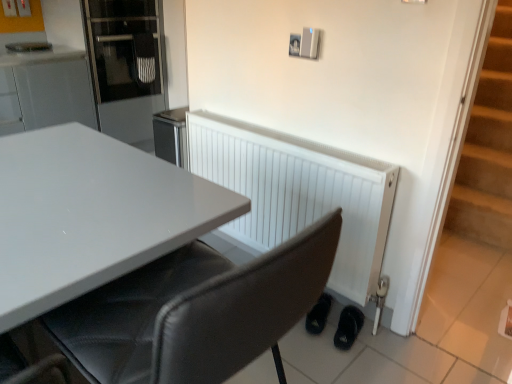
Question: Considering the relative sizes of white matte radiator at lower right and black leather chair at center in the image provided, is white matte radiator at lower right smaller than black leather chair at center?

Choices:
 (A) no
 (B) yes

Answer: (B)

Question: Is white matte radiator at lower right positioned beyond the bounds of black leather chair at center?

Choices:
 (A) yes
 (B) no

Answer: (A)

Question: Is white matte radiator at lower right touching black leather chair at center?

Choices:
 (A) yes
 (B) no

Answer: (B)

Question: From a real-world perspective, is white matte radiator at lower right positioned over black leather chair at center based on gravity?

Choices:
 (A) no
 (B) yes

Answer: (A)

Question: From the image's perspective, does white matte radiator at lower right appear higher than black leather chair at center?

Choices:
 (A) yes
 (B) no

Answer: (A)

Question: Considering the relative sizes of white matte radiator at lower right and black leather chair at center in the image provided, is white matte radiator at lower right wider than black leather chair at center?

Choices:
 (A) yes
 (B) no

Answer: (B)

Question: Is glass door refrigerator at upper left far away from black leather chair at center?

Choices:
 (A) no
 (B) yes

Answer: (B)

Question: Considering the relative sizes of glass door refrigerator at upper left and black leather chair at center in the image provided, is glass door refrigerator at upper left wider than black leather chair at center?

Choices:
 (A) no
 (B) yes

Answer: (B)

Question: Is glass door refrigerator at upper left positioned with its back to black leather chair at center?

Choices:
 (A) yes
 (B) no

Answer: (B)

Question: From the image's perspective, does glass door refrigerator at upper left appear higher than black leather chair at center?

Choices:
 (A) yes
 (B) no

Answer: (A)

Question: From a real-world perspective, is glass door refrigerator at upper left located higher than black leather chair at center?

Choices:
 (A) yes
 (B) no

Answer: (A)

Question: From a real-world perspective, is glass door refrigerator at upper left located beneath black leather chair at center?

Choices:
 (A) no
 (B) yes

Answer: (A)

Question: Is white matte radiator at lower right located outside black leather shoes at lower right, the 1th footwear positioned from the left?

Choices:
 (A) no
 (B) yes

Answer: (B)